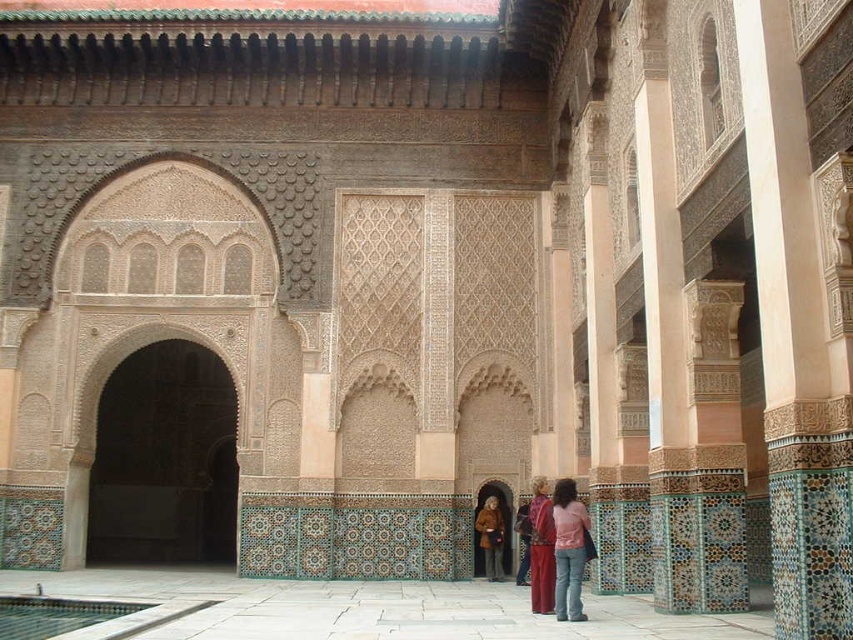
You are standing in the Moroccan courtyard and see the white stone floor at center and the brown leather jacket at center. Which object is positioned to the left side from your perspective?

The white stone floor at center is to the left of the brown leather jacket at center, so the white stone floor at center is positioned to the left side from your perspective.

You are standing in the Moroccan courtyard and see the point marked at coordinates point (57, 614). What is the nearest object to this point?

The nearest object to point (57, 614) is the clear glass pool at lower left, as the point is located on it.